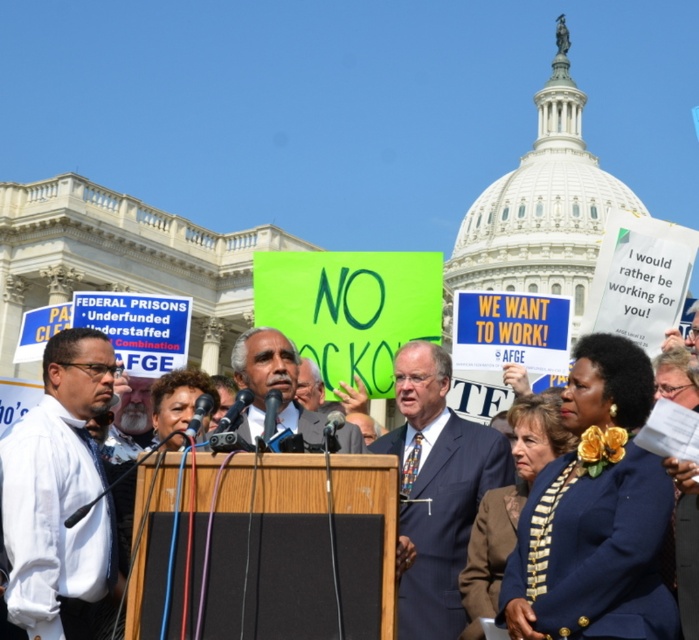
Does dark blue suit at center come behind matte black suit at center?

No, dark blue suit at center is closer to the viewer.

I want to click on dark blue suit at center, so click(x=435, y=490).

Which is behind, point (57, 442) or point (240, 356)?

Positioned behind is point (240, 356).

Between white shirt at left and matte black suit at center, which one appears on the right side from the viewer's perspective?

From the viewer's perspective, matte black suit at center appears more on the right side.

Is point (94, 492) in front of point (303, 420)?

That is True.

The height and width of the screenshot is (640, 699). I want to click on white shirt at left, so click(x=59, y=492).

Is matte black suit at center further to camera compared to blue fabric suit at center?

Yes, matte black suit at center is further from the viewer.

Does matte black suit at center have a lesser width compared to blue fabric suit at center?

Correct, matte black suit at center's width is less than blue fabric suit at center's.

Is point (361, 445) more distant than point (679, 497)?

Yes, point (361, 445) is farther from viewer.

The image size is (699, 640). I want to click on matte black suit at center, so click(271, 381).